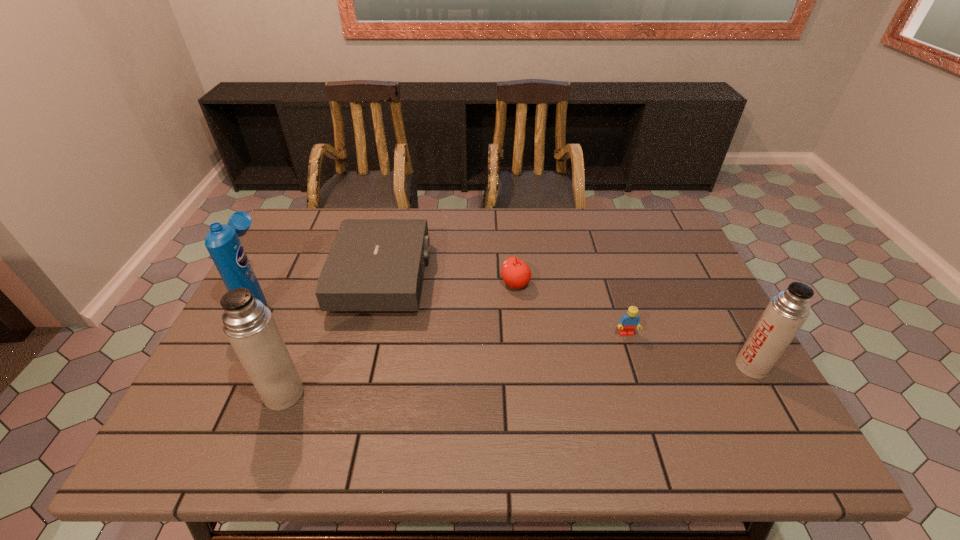
Where is `free space between the projector and the fourth object from left to right`? This screenshot has width=960, height=540. free space between the projector and the fourth object from left to right is located at coordinates (449, 281).

Identify the location of free space between the rightmost object and the projector. (567, 322).

Image resolution: width=960 pixels, height=540 pixels. Find the location of `the third closest object to the projector`. the third closest object to the projector is located at coordinates (516, 274).

Locate an element on the screen. the third closest object to the apple is located at coordinates (786, 313).

At what (x,y) coordinates should I click in order to perform the action: click on free space that satisfies the following two spatial constraints: 1. on the front-facing side of the shorter thermos bottle; 2. on the right side of the projector. Please return your answer as a coordinate pair (x, y). The height and width of the screenshot is (540, 960). Looking at the image, I should click on (361, 367).

Locate an element on the screen. This screenshot has width=960, height=540. blank area in the image that satisfies the following two spatial constraints: 1. on the front-facing side of the projector; 2. on the left side of the rightmost object is located at coordinates (361, 367).

The image size is (960, 540). Find the location of `free region that satisfies the following two spatial constraints: 1. on the face of the Lego; 2. on the left side of the right thermos bottle`. free region that satisfies the following two spatial constraints: 1. on the face of the Lego; 2. on the left side of the right thermos bottle is located at coordinates (636, 367).

Identify the location of vacant space that satisfies the following two spatial constraints: 1. on the front side of the shampoo; 2. on the right side of the left thermos bottle. The height and width of the screenshot is (540, 960). (211, 394).